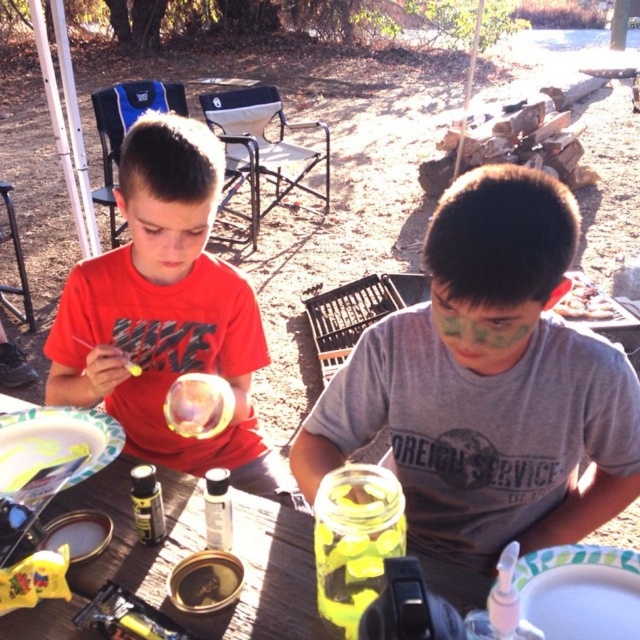
You are a photographer trying to capture a closeup shot of the green matte face paint at center and the matte red shirt at center. Since you want both elements in focus, you need to know their vertical positions. Can you tell me which one is lower in the image?

The green matte face paint at center is located below the matte red shirt at center, so the green matte face paint at center is lower in the image.

You are a photographer taking a picture of the scene. The green matte face paint at center is located at point (483, 328). To ensure it is in focus, you need to know its position relative to the boys. Which boy is closer to the green matte face paint at center?

The green matte face paint at center is located at point (483, 328). Since the boys are seated at the wooden table, and the face paint is at the center of the scene, it is likely positioned between them or on the table where both can access it. However, without specific spatial details about their exact seating positions relative to the coordinate, we cannot definitively determine which boy is closer.

You are a photographer trying to capture a closeup of the matte red shirt at left and the green matte paint at upper center. Which object should you zoom in on first if you want to focus on the wider object?

The matte red shirt at left is wider than the green matte paint at upper center, so you should zoom in on the matte red shirt at left first to focus on the wider object.